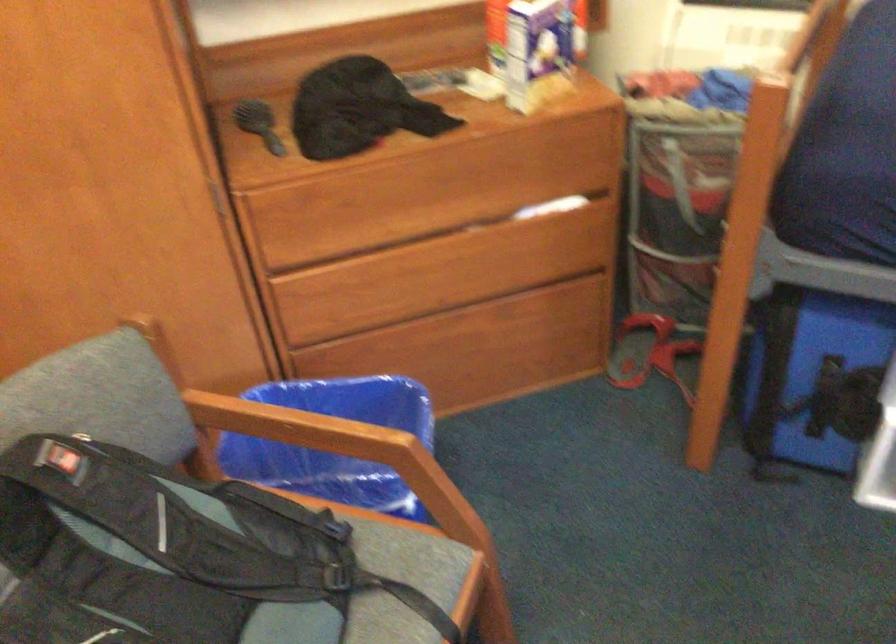
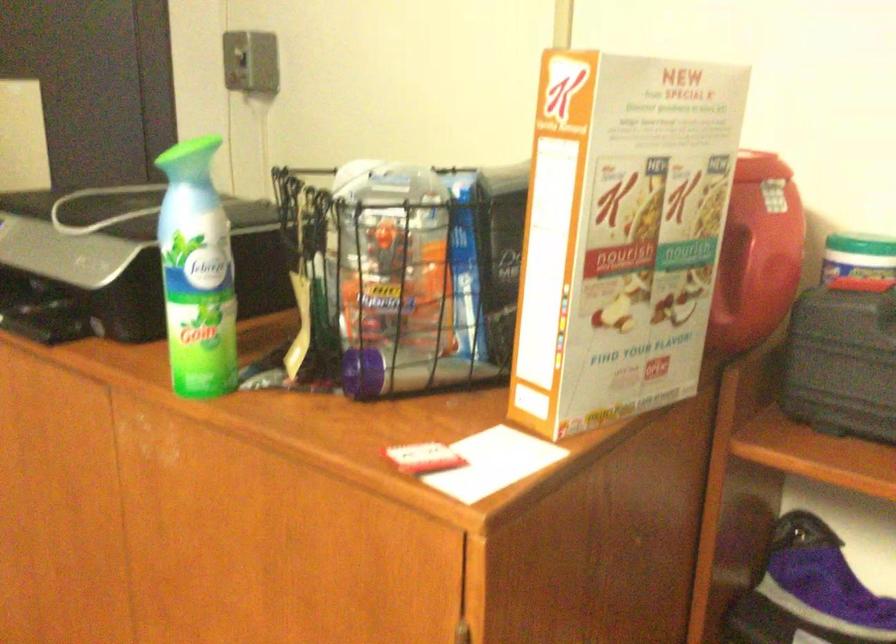
Question: The camera is either moving clockwise (left) or counter-clockwise (right) around the object. The first image is from the beginning of the video and the second image is from the end. Is the camera moving left or right when shooting the video?

Choices:
 (A) Left
 (B) Right

Answer: (B)